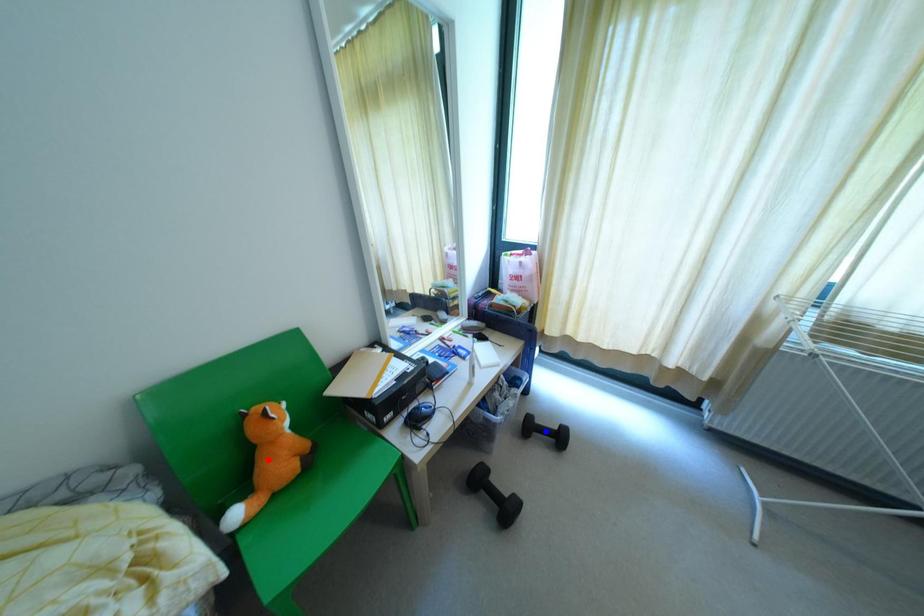
Question: Which of the two points in the image is closer to the camera?

Choices:
 (A) Blue point is closer.
 (B) Red point is closer.

Answer: (B)